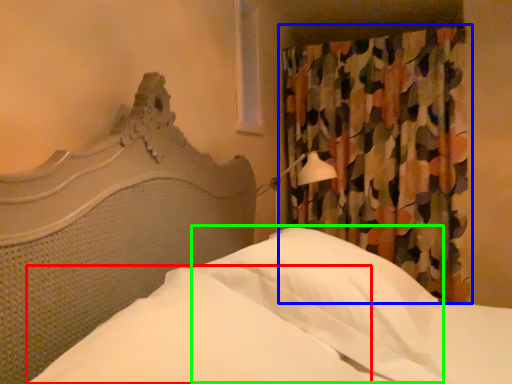
Question: Based on their relative distances, which object is nearer to sheet (highlighted by a red box)? Choose from curtain (highlighted by a blue box) and pillow (highlighted by a green box).

Choices:
 (A) curtain
 (B) pillow

Answer: (B)